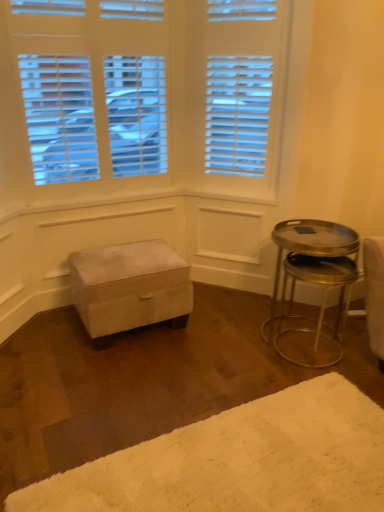
Question: Does white fluffy rug at lower right appear on the right side of metallic silver table at right?

Choices:
 (A) no
 (B) yes

Answer: (A)

Question: Is white fluffy rug at lower right closer to the viewer compared to metallic silver table at right?

Choices:
 (A) yes
 (B) no

Answer: (A)

Question: Can you confirm if white fluffy rug at lower right is wider than metallic silver table at right?

Choices:
 (A) yes
 (B) no

Answer: (A)

Question: Is white fluffy rug at lower right next to metallic silver table at right?

Choices:
 (A) yes
 (B) no

Answer: (B)

Question: Is white fluffy rug at lower right smaller than metallic silver table at right?

Choices:
 (A) no
 (B) yes

Answer: (B)

Question: Considering the positions of velvet ottoman at center and white fluffy rug at lower right in the image, is velvet ottoman at center taller or shorter than white fluffy rug at lower right?

Choices:
 (A) tall
 (B) short

Answer: (A)

Question: Considering the positions of velvet ottoman at center and white fluffy rug at lower right in the image, is velvet ottoman at center wider or thinner than white fluffy rug at lower right?

Choices:
 (A) thin
 (B) wide

Answer: (A)

Question: Considering their positions, is velvet ottoman at center located in front of or behind white fluffy rug at lower right?

Choices:
 (A) front
 (B) behind

Answer: (B)

Question: From a real-world perspective, is velvet ottoman at center positioned above or below white fluffy rug at lower right?

Choices:
 (A) above
 (B) below

Answer: (A)

Question: From a real-world perspective, relative to metallic silver table at right, is white fluffy rug at lower right vertically above or below?

Choices:
 (A) below
 (B) above

Answer: (A)

Question: Considering the positions of white fluffy rug at lower right and metallic silver table at right in the image, is white fluffy rug at lower right wider or thinner than metallic silver table at right?

Choices:
 (A) wide
 (B) thin

Answer: (A)

Question: From the image's perspective, is white fluffy rug at lower right positioned above or below metallic silver table at right?

Choices:
 (A) below
 (B) above

Answer: (A)

Question: Is white fluffy rug at lower right taller or shorter than metallic silver table at right?

Choices:
 (A) short
 (B) tall

Answer: (A)

Question: In terms of height, does white fluffy rug at lower right look taller or shorter compared to velvet ottoman at center?

Choices:
 (A) tall
 (B) short

Answer: (B)

Question: From a real-world perspective, is white fluffy rug at lower right positioned above or below velvet ottoman at center?

Choices:
 (A) above
 (B) below

Answer: (B)